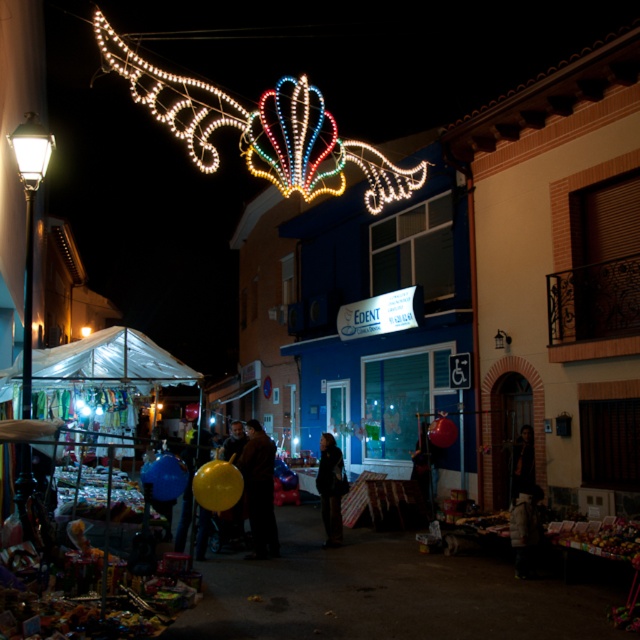
This screenshot has width=640, height=640. Describe the element at coordinates (259, 490) in the screenshot. I see `smooth yellow balloon at center` at that location.

Is smooth yellow balloon at center above dark blue jacket at center?

Yes.

Identify the location of smooth yellow balloon at center. (259, 490).

Is illuminated plastic shell at upper center wider than dark blue jacket at center?

Yes.

You are a GUI agent. You are given a task and a screenshot of the screen. Output one action in this format:
    pyautogui.click(x=<x>, y=<y>)
    Task: Click on the illuminated plastic shell at upper center
    The image size is (640, 640).
    Given the screenshot: What is the action you would take?
    pyautogui.click(x=260, y=129)

Measure the distance between point (278, 168) and camera.

The distance of point (278, 168) from camera is 17.71 meters.

Is illuminated plastic shell at upper center above white glass streetlight at left?

Correct, illuminated plastic shell at upper center is located above white glass streetlight at left.

Find the location of a particular element. Image resolution: width=640 pixels, height=640 pixels. illuminated plastic shell at upper center is located at coordinates (260, 129).